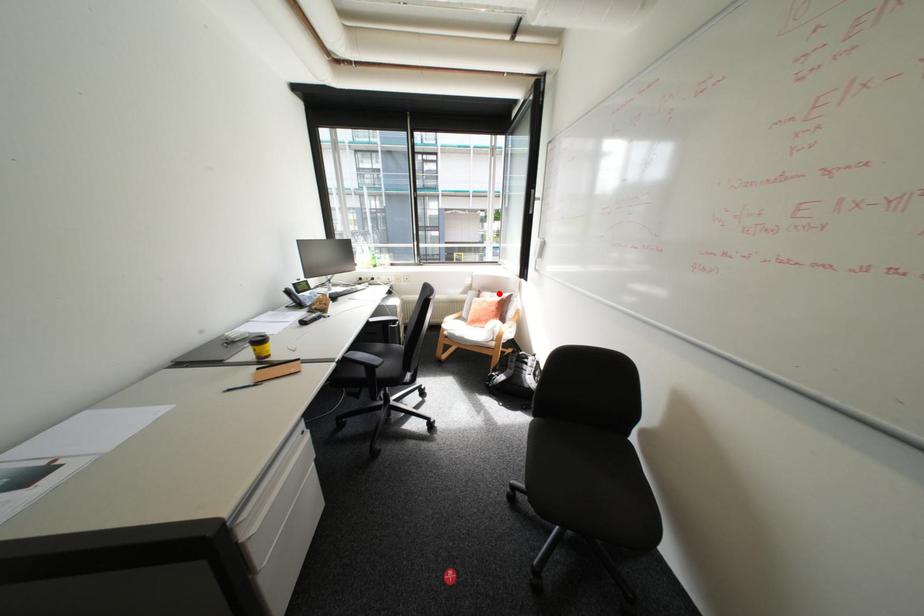
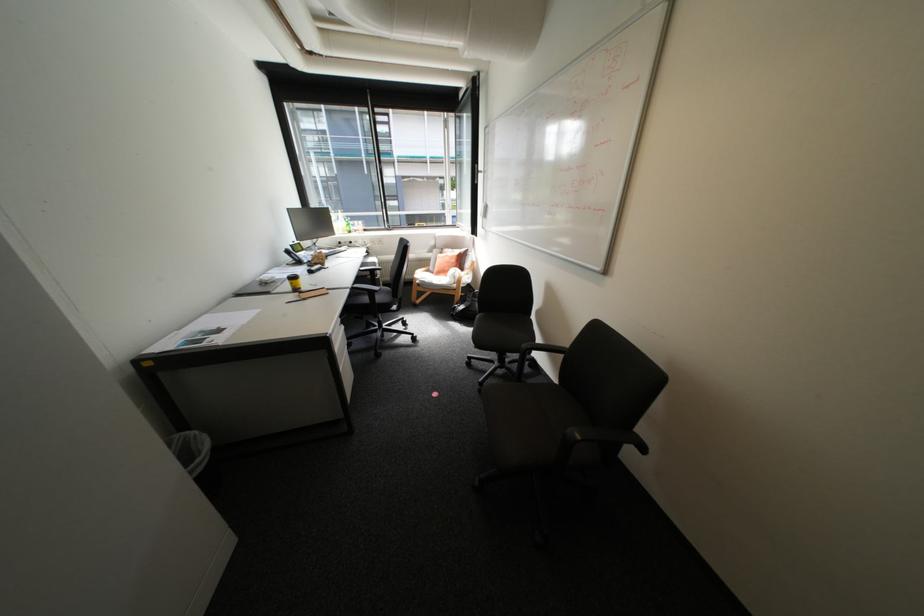
Where in the second image is the point corresponding to the highlighted location from the first image?

(459, 249)